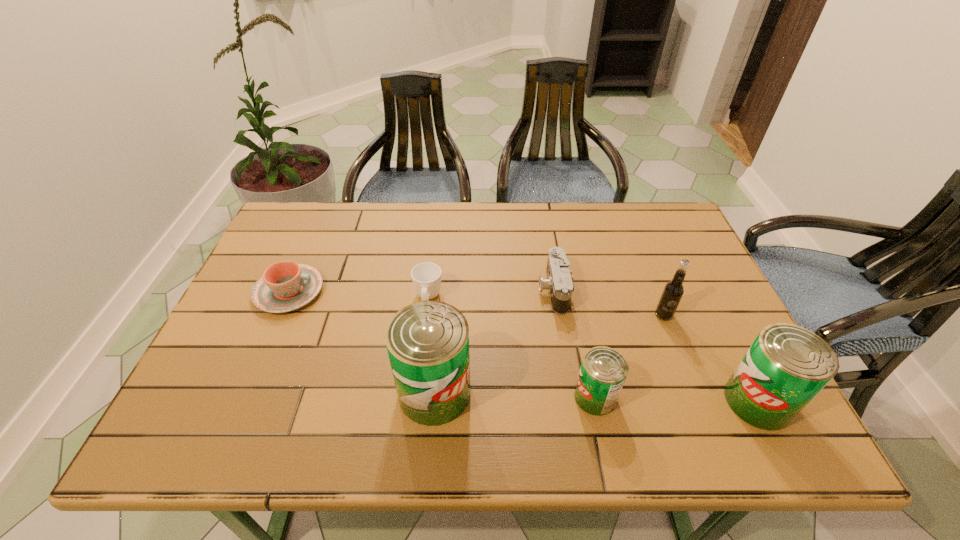
Where is `root beer located at the right edge`? The width and height of the screenshot is (960, 540). root beer located at the right edge is located at coordinates (672, 293).

You are a GUI agent. You are given a task and a screenshot of the screen. Output one action in this format:
    pyautogui.click(x=<x>, y=<y>)
    Task: Click on the object positioned at the near right corner
    This screenshot has height=540, width=960.
    Given the screenshot: What is the action you would take?
    pyautogui.click(x=787, y=365)

Locate an element on the screen. The width and height of the screenshot is (960, 540). vacant space at the far edge of the desktop is located at coordinates (545, 219).

In the image, there is a desktop. Where is `free region at the near edge`? free region at the near edge is located at coordinates (395, 403).

In the image, there is a desktop. Where is `vacant space at the right edge`? This screenshot has height=540, width=960. vacant space at the right edge is located at coordinates (742, 348).

I want to click on free space at the near left corner of the desktop, so click(x=245, y=374).

This screenshot has height=540, width=960. Identify the location of free space at the near right corner of the desktop. (713, 377).

Locate an element on the screen. Image resolution: width=960 pixels, height=540 pixels. free space that is in between the cup and the camera is located at coordinates (491, 294).

Image resolution: width=960 pixels, height=540 pixels. Find the location of `vacant area that lies between the camera and the second shortest can`. vacant area that lies between the camera and the second shortest can is located at coordinates (656, 346).

You are a GUI agent. You are given a task and a screenshot of the screen. Output one action in this format:
    pyautogui.click(x=<x>, y=<y>)
    Task: Click on the vacant area between the camera and the leftmost can
    The image size is (960, 540).
    Given the screenshot: What is the action you would take?
    pyautogui.click(x=494, y=341)